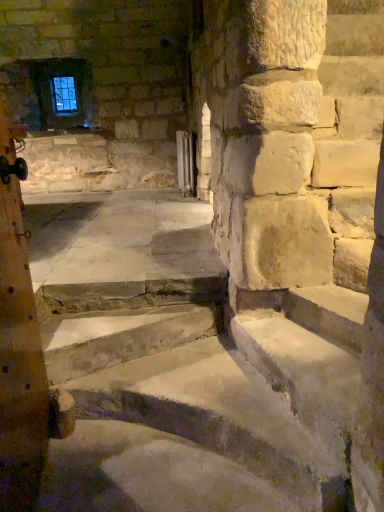
Question: Can you confirm if wooden post at left is wider than smooth stone stairs at center?

Choices:
 (A) yes
 (B) no

Answer: (B)

Question: Is the surface of wooden post at left in direct contact with smooth stone stairs at center?

Choices:
 (A) no
 (B) yes

Answer: (A)

Question: Considering the relative sizes of wooden post at left and smooth stone stairs at center in the image provided, is wooden post at left bigger than smooth stone stairs at center?

Choices:
 (A) yes
 (B) no

Answer: (A)

Question: Is wooden post at left positioned with its back to smooth stone stairs at center?

Choices:
 (A) yes
 (B) no

Answer: (B)

Question: Can you confirm if wooden post at left is thinner than smooth stone stairs at center?

Choices:
 (A) no
 (B) yes

Answer: (B)

Question: Can you confirm if wooden post at left is smaller than smooth stone stairs at center?

Choices:
 (A) no
 (B) yes

Answer: (A)

Question: Does metallic radiator at center appear on the left side of smooth stone stairs at center?

Choices:
 (A) no
 (B) yes

Answer: (A)

Question: From the image's perspective, is metallic radiator at center above smooth stone stairs at center?

Choices:
 (A) yes
 (B) no

Answer: (A)

Question: Is metallic radiator at center oriented towards smooth stone stairs at center?

Choices:
 (A) yes
 (B) no

Answer: (B)

Question: Is metallic radiator at center positioned beyond the bounds of smooth stone stairs at center?

Choices:
 (A) yes
 (B) no

Answer: (A)

Question: Is metallic radiator at center positioned in front of smooth stone stairs at center?

Choices:
 (A) yes
 (B) no

Answer: (B)

Question: Can you confirm if metallic radiator at center is positioned to the right of smooth stone stairs at center?

Choices:
 (A) yes
 (B) no

Answer: (A)

Question: Considering the relative positions of smooth stone stairs at center and metallic radiator at center in the image provided, is smooth stone stairs at center to the right of metallic radiator at center from the viewer's perspective?

Choices:
 (A) yes
 (B) no

Answer: (B)